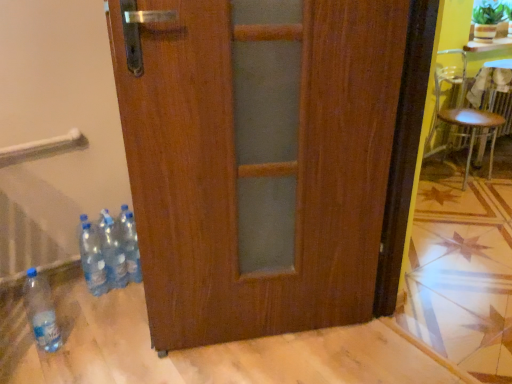
Question: From a real-world perspective, is transparent plastic bottles at lower left, marked as the third bottle in a right-to-left arrangement, over translucent plastic bottles at lower left, the third bottle in the left-to-right sequence?

Choices:
 (A) yes
 (B) no

Answer: (B)

Question: Is transparent plastic bottles at lower left, the 2th bottle positioned from the left, positioned beyond the bounds of translucent plastic bottles at lower left, the third bottle in the left-to-right sequence?

Choices:
 (A) yes
 (B) no

Answer: (A)

Question: Is transparent plastic bottles at lower left, marked as the third bottle in a right-to-left arrangement, facing away from translucent plastic bottles at lower left, the third bottle in the left-to-right sequence?

Choices:
 (A) yes
 (B) no

Answer: (B)

Question: Is transparent plastic bottles at lower left, marked as the third bottle in a right-to-left arrangement, placed right next to translucent plastic bottles at lower left, the third bottle in the left-to-right sequence?

Choices:
 (A) yes
 (B) no

Answer: (A)

Question: Is transparent plastic bottles at lower left, marked as the third bottle in a right-to-left arrangement, positioned before translucent plastic bottles at lower left, the third bottle in the left-to-right sequence?

Choices:
 (A) no
 (B) yes

Answer: (B)

Question: Does transparent plastic bottles at lower left, the 2th bottle positioned from the left, appear on the right side of translucent plastic bottles at lower left, the second bottle when ordered from right to left?

Choices:
 (A) no
 (B) yes

Answer: (A)

Question: Can you confirm if metallic silver chair at right is shorter than green leafy plant at upper right?

Choices:
 (A) yes
 (B) no

Answer: (B)

Question: Is green leafy plant at upper right surrounded by metallic silver chair at right?

Choices:
 (A) yes
 (B) no

Answer: (B)

Question: Does metallic silver chair at right come in front of green leafy plant at upper right?

Choices:
 (A) no
 (B) yes

Answer: (B)

Question: Is metallic silver chair at right taller than green leafy plant at upper right?

Choices:
 (A) no
 (B) yes

Answer: (B)

Question: Is metallic silver chair at right thinner than green leafy plant at upper right?

Choices:
 (A) yes
 (B) no

Answer: (B)

Question: Considering the relative positions of metallic silver chair at right and green leafy plant at upper right in the image provided, is metallic silver chair at right behind green leafy plant at upper right?

Choices:
 (A) no
 (B) yes

Answer: (A)

Question: Does metallic silver chair at right appear on the left side of translucent plastic bottles at lower left, the second bottle when ordered from right to left?

Choices:
 (A) no
 (B) yes

Answer: (A)